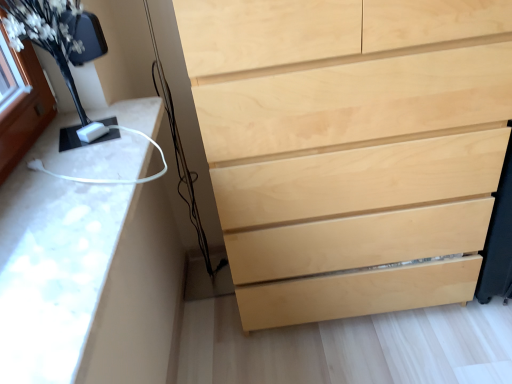
This screenshot has width=512, height=384. Describe the element at coordinates (350, 147) in the screenshot. I see `light wood chest of drawers at center` at that location.

Locate an element on the screen. The height and width of the screenshot is (384, 512). light wood chest of drawers at center is located at coordinates (350, 147).

Identify the location of light wood chest of drawers at center. (350, 147).